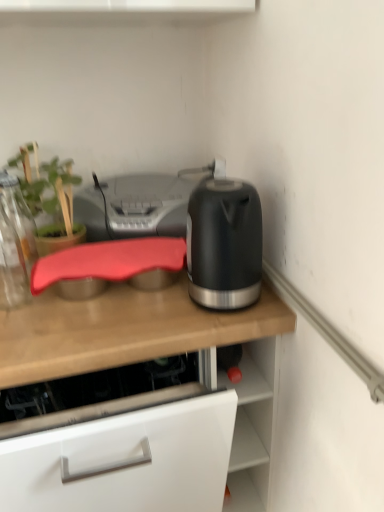
Question: Is silver metallic printer at center facing towards matte wooden countertop at center?

Choices:
 (A) no
 (B) yes

Answer: (A)

Question: Is silver metallic printer at center shorter than matte wooden countertop at center?

Choices:
 (A) no
 (B) yes

Answer: (B)

Question: From the image's perspective, is silver metallic printer at center located beneath matte wooden countertop at center?

Choices:
 (A) yes
 (B) no

Answer: (B)

Question: Can you confirm if silver metallic printer at center is wider than matte wooden countertop at center?

Choices:
 (A) yes
 (B) no

Answer: (B)

Question: Is silver metallic printer at center taller than matte wooden countertop at center?

Choices:
 (A) no
 (B) yes

Answer: (A)

Question: Is transparent glass bottle at left bigger or smaller than green matte plant at upper left?

Choices:
 (A) big
 (B) small

Answer: (A)

Question: Is transparent glass bottle at left wider or thinner than green matte plant at upper left?

Choices:
 (A) thin
 (B) wide

Answer: (B)

Question: Based on their positions, is transparent glass bottle at left located to the left or right of green matte plant at upper left?

Choices:
 (A) right
 (B) left

Answer: (A)

Question: Considering the positions of point (1, 241) and point (66, 181), is point (1, 241) closer or farther from the camera than point (66, 181)?

Choices:
 (A) closer
 (B) farther

Answer: (B)

Question: Considering the positions of point (180, 215) and point (43, 172), is point (180, 215) closer or farther from the camera than point (43, 172)?

Choices:
 (A) farther
 (B) closer

Answer: (B)

Question: From the image's perspective, relative to green matte plant at upper left, is silver metallic printer at center above or below?

Choices:
 (A) below
 (B) above

Answer: (A)

Question: Considering the positions of silver metallic printer at center and green matte plant at upper left in the image, is silver metallic printer at center bigger or smaller than green matte plant at upper left?

Choices:
 (A) small
 (B) big

Answer: (B)

Question: Visually, is silver metallic printer at center positioned to the left or to the right of green matte plant at upper left?

Choices:
 (A) right
 (B) left

Answer: (A)

Question: Visually, is matte black kettle at right positioned to the left or to the right of matte wooden countertop at center?

Choices:
 (A) right
 (B) left

Answer: (A)

Question: From the image's perspective, relative to matte wooden countertop at center, is matte black kettle at right above or below?

Choices:
 (A) above
 (B) below

Answer: (A)